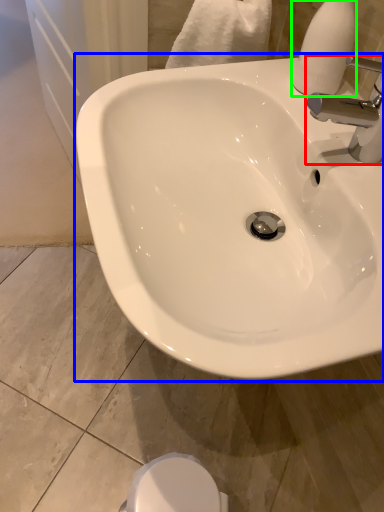
Question: Estimate the real-world distances between objects in this image. Which object is farther from tap (highlighted by a red box), sink (highlighted by a blue box) or soap dispenser (highlighted by a green box)?

Choices:
 (A) sink
 (B) soap dispenser

Answer: (A)